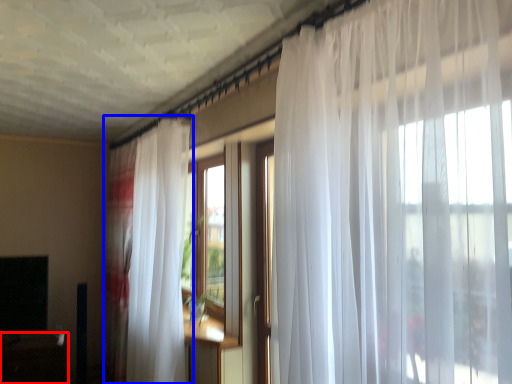
Question: Which object is closer to the camera taking this photo, table (highlighted by a red box) or curtain (highlighted by a blue box)?

Choices:
 (A) table
 (B) curtain

Answer: (B)